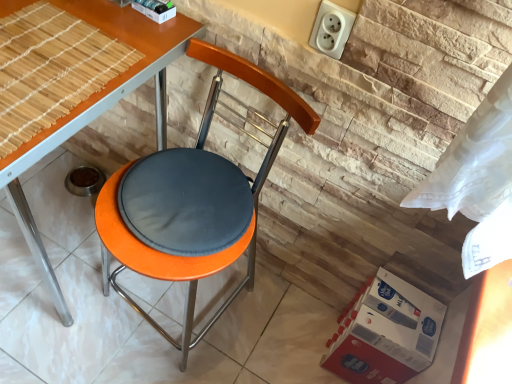
Locate an element on the screen. spots to the right of orange fabric-covered chair at center is located at coordinates (270, 335).